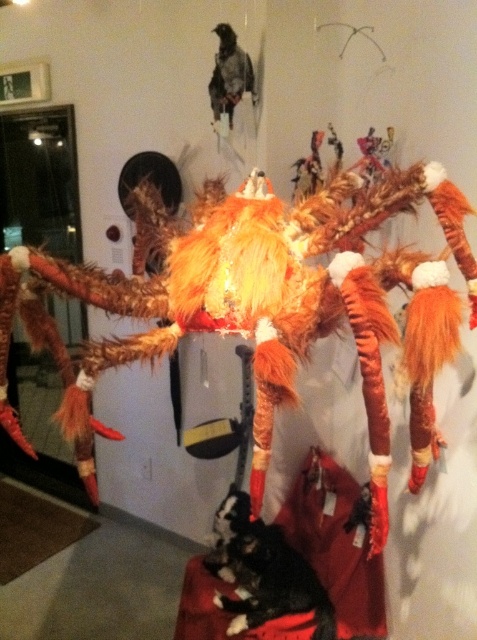
Who is higher up, black fur cat at lower center or dark gray feathers at upper center?

Positioned higher is dark gray feathers at upper center.

Locate an element on the screen. black fur cat at lower center is located at coordinates (266, 577).

Where is `black fur cat at lower center`? The height and width of the screenshot is (640, 477). black fur cat at lower center is located at coordinates (266, 577).

Between fuzzy orange fox at center and dark gray feathers at upper center, which one is positioned higher?

Positioned higher is dark gray feathers at upper center.

Where is `fuzzy orange fox at center`? The image size is (477, 640). fuzzy orange fox at center is located at coordinates (263, 301).

Image resolution: width=477 pixels, height=640 pixels. Identify the location of fuzzy orange fox at center. (263, 301).

Identify the location of fuzzy orange fox at center. pyautogui.click(x=263, y=301).

This screenshot has width=477, height=640. What do you see at coordinates (263, 301) in the screenshot?
I see `fuzzy orange fox at center` at bounding box center [263, 301].

Image resolution: width=477 pixels, height=640 pixels. Identify the location of fuzzy orange fox at center. (263, 301).